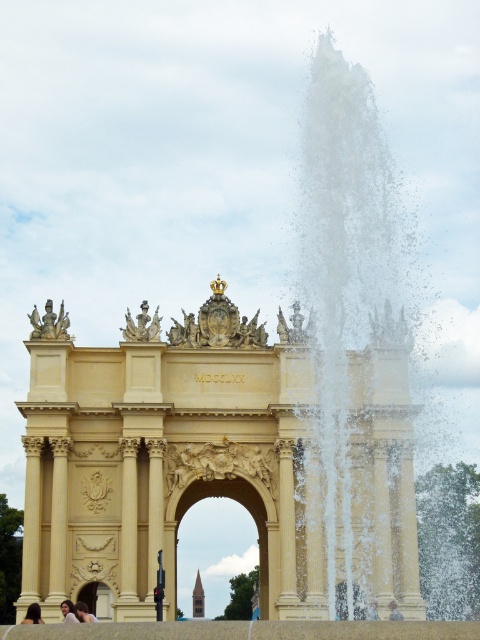
Between blonde hair person at lower left and light brown hair at lower left, which one has less height?

blonde hair person at lower left

Which is above, blonde hair person at lower left or light brown hair at lower left?

Positioned higher is light brown hair at lower left.

Who is more forward, (82, 604) or (64, 620)?

Point (64, 620) is in front.

What are the coordinates of `blonde hair person at lower left` in the screenshot? It's located at (84, 612).

Looking at this image, which is more to the right, blonde hair person at lower left or light brown hair at center?

light brown hair at center

Is blonde hair person at lower left to the left of light brown hair at center from the viewer's perspective?

Indeed, blonde hair person at lower left is positioned on the left side of light brown hair at center.

Image resolution: width=480 pixels, height=640 pixels. What do you see at coordinates (84, 612) in the screenshot? I see `blonde hair person at lower left` at bounding box center [84, 612].

Find the location of `blonde hair person at lower left`. blonde hair person at lower left is located at coordinates (84, 612).

Where is `blonde hair at lower left`? The width and height of the screenshot is (480, 640). blonde hair at lower left is located at coordinates (33, 614).

Is blonde hair at lower left taller than light brown hair at lower left?

In fact, blonde hair at lower left may be shorter than light brown hair at lower left.

The width and height of the screenshot is (480, 640). Find the location of `blonde hair at lower left`. blonde hair at lower left is located at coordinates (33, 614).